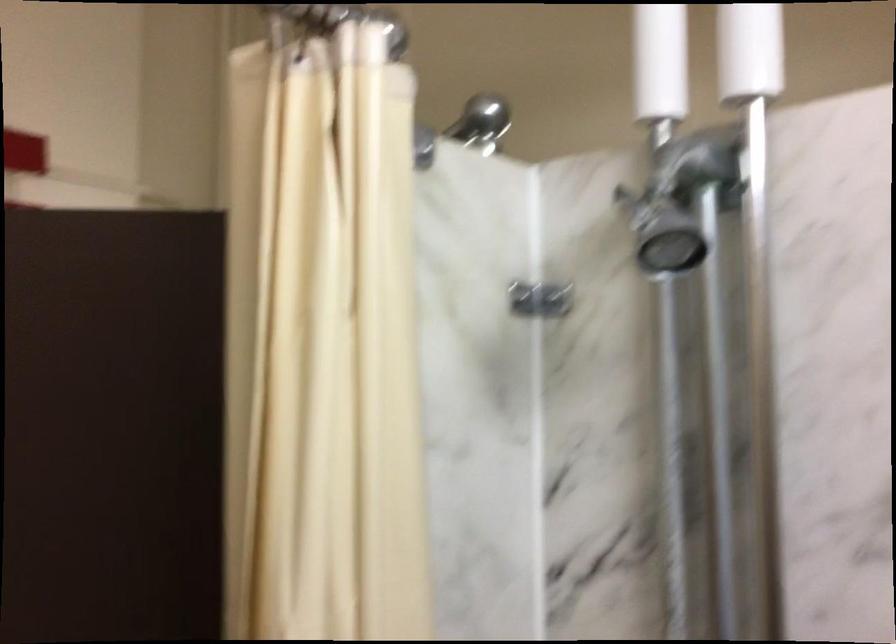
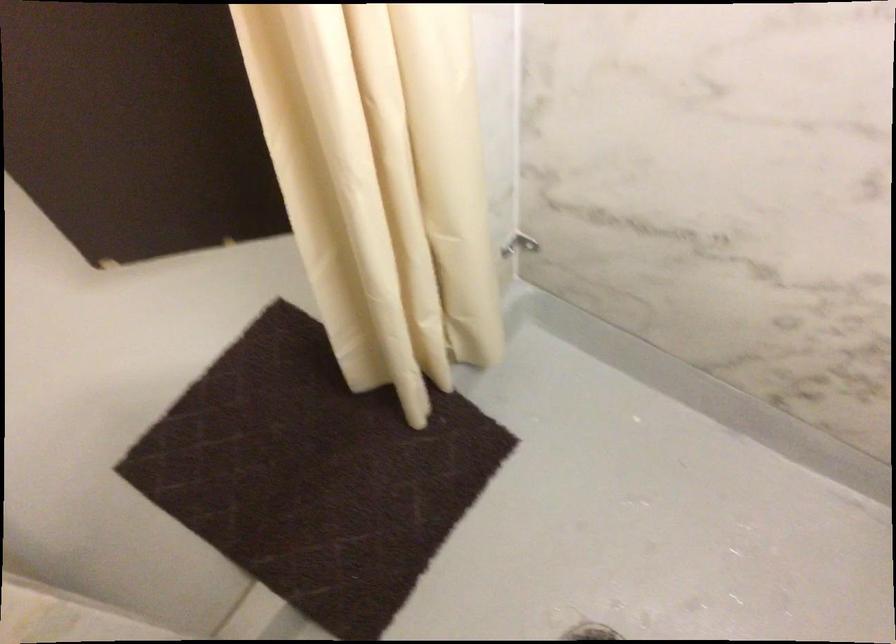
How did the camera likely rotate?

The camera rotated toward right-down.